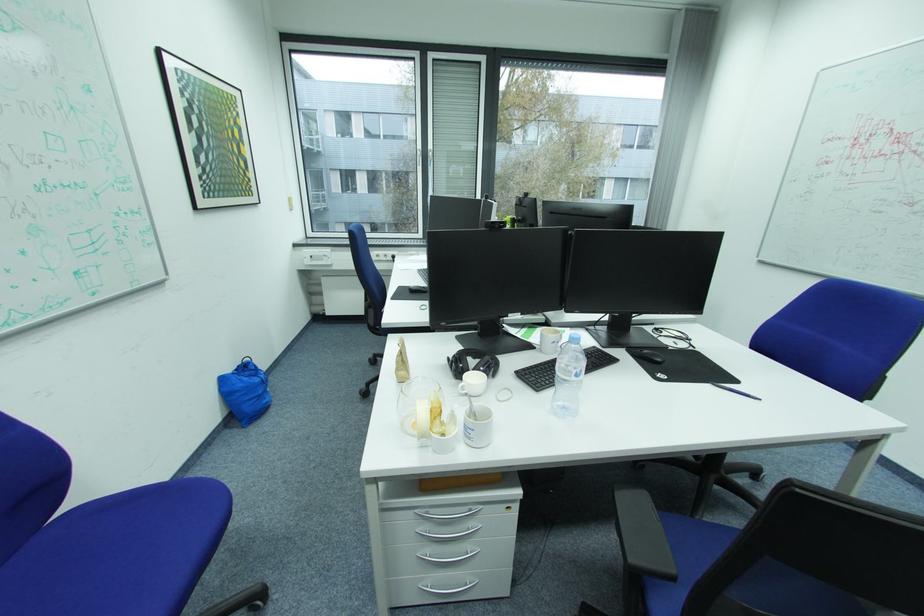
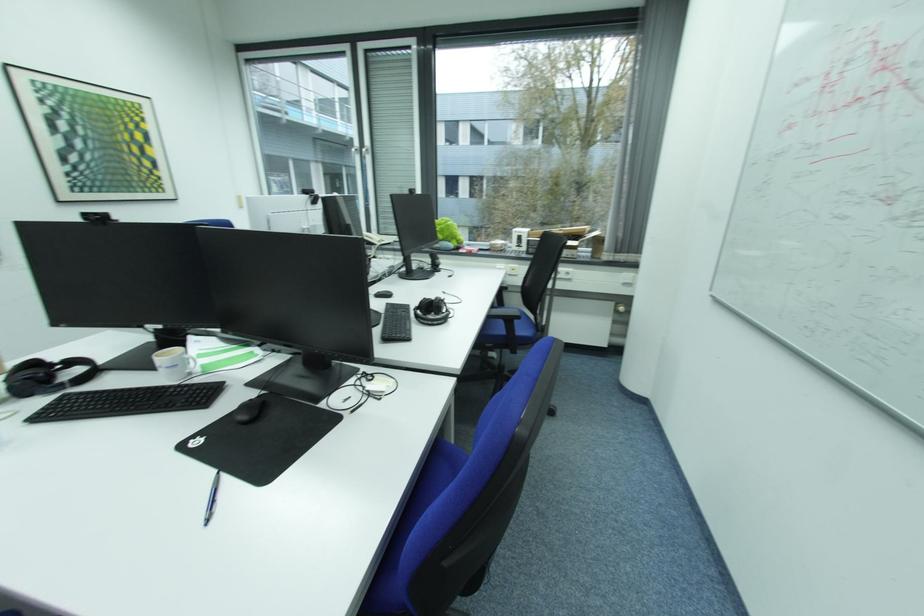
Which direction would the cameraman need to move to produce the second image?

The movement direction of the cameraman is right, forward.